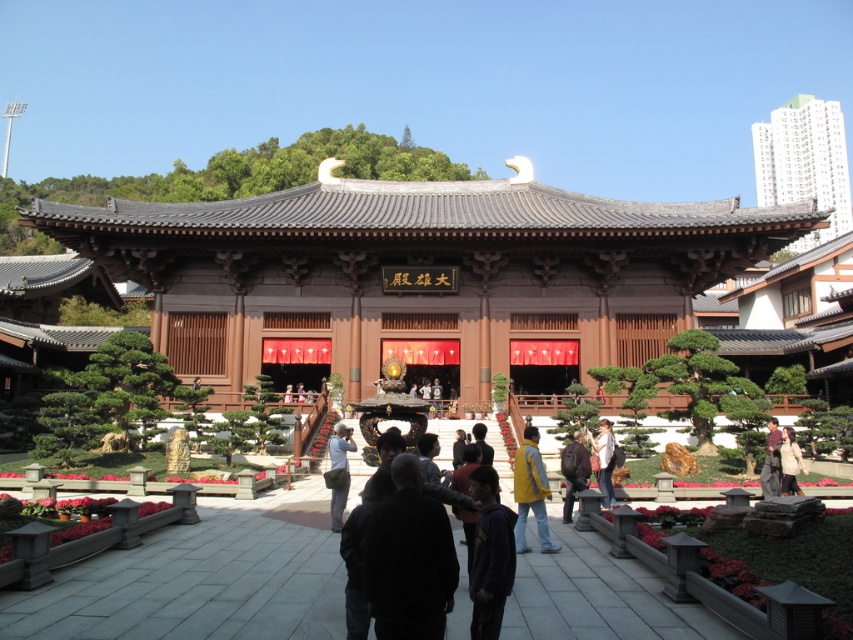
Question: Does light blue denim jeans at center have a greater width compared to denim jacket at lower center?

Choices:
 (A) yes
 (B) no

Answer: (A)

Question: Which object is the farthest from the brown leather jacket at center?

Choices:
 (A) yellow fabric jacket at center
 (B) dark blue hoodie at center
 (C) light brown leather jacket at lower right
 (D) white concrete building at upper right

Answer: (D)

Question: Is dark blue hoodie at center above brown leather jacket at center?

Choices:
 (A) yes
 (B) no

Answer: (A)

Question: Among these points, which one is nearest to the camera?

Choices:
 (A) (541, 540)
 (B) (340, 499)

Answer: (A)

Question: Does yellow fabric jacket at center appear on the right side of denim jacket at lower center?

Choices:
 (A) yes
 (B) no

Answer: (B)

Question: Which point appears farthest from the camera in this image?

Choices:
 (A) (500, 593)
 (B) (775, 461)

Answer: (B)